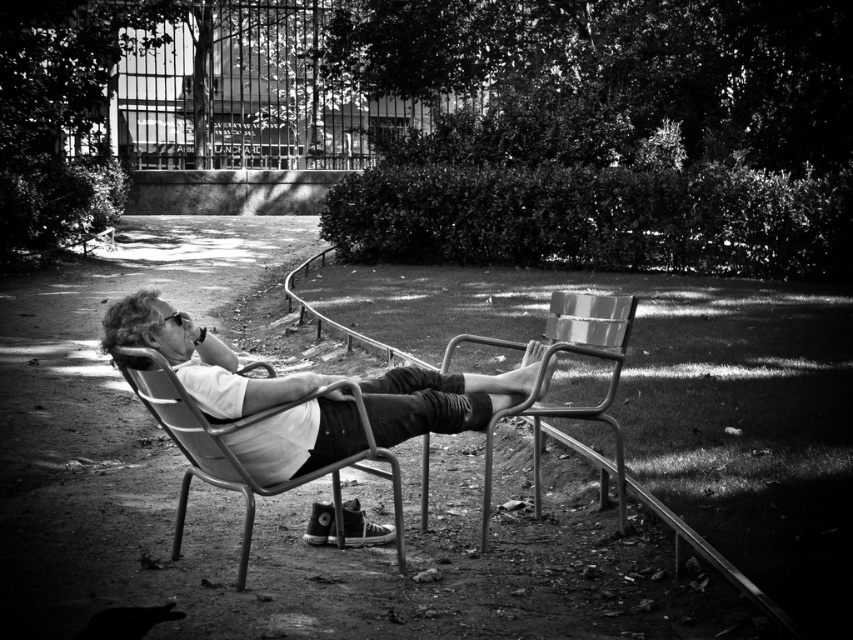
You are standing at the edge of the grassy area near the curved metal railing. You see both the metallic frame chair at center and the metallic silver beach chair at center. Which chair is closer to the paved path or road?

The metallic frame chair at center is positioned on the left side of the metallic silver beach chair at center. Since the curved metal railing separates the grassy area from the paved path or road, the chair closer to the railing would be nearer to the path. However, without knowing their exact positions relative to the railing, we can only state their spatial relationship to each other. The metallic frame chair at center is to the left of the metallic silver beach chair at center, but their proximity to he

From the picture: You are a photographer trying to capture the scene from the left side of the paved path. Which chair, the metallic silver chair at center or the metallic frame chair at center, is closer to the curved metal railing?

The metallic silver chair at center is positioned on the right side of the metallic frame chair at center, so the metallic frame chair at center is closer to the curved metal railing.

You are standing at the camera position and want to place a 2.5 meter long ladder between you and the metallic frame chair at center. Can the ladder fit entirely between you and the chair?

The distance between the metallic frame chair at center and the camera is 4.06 meters. Since the ladder is 2.5 meters long, it can fit entirely between you and the chair as the distance is greater than the ladder length.